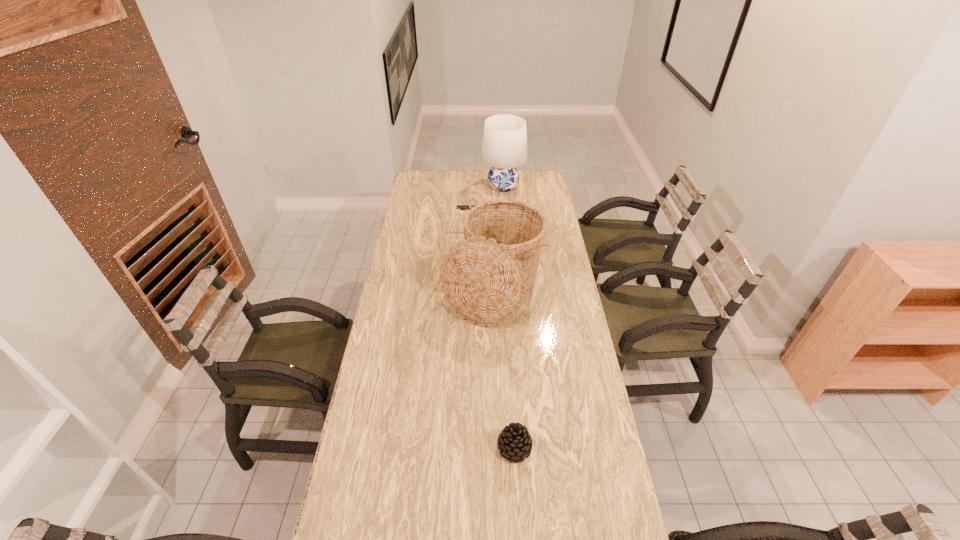
Where is `vacant space located 0.110m along the barrel of the gun`? This screenshot has width=960, height=540. vacant space located 0.110m along the barrel of the gun is located at coordinates (434, 226).

At what (x,y) coordinates should I click in order to perform the action: click on vacant region located 0.150m at the narrow end of the nearest object. Please return your answer as a coordinate pair (x, y). Looking at the image, I should click on (446, 448).

At what (x,y) coordinates should I click in order to perform the action: click on vacant space located at the narrow end of the nearest object. Please return your answer as a coordinate pair (x, y). The width and height of the screenshot is (960, 540). Looking at the image, I should click on (437, 448).

The image size is (960, 540). In order to click on vacant space located at the narrow end of the nearest object in this screenshot , I will do `click(426, 448)`.

Find the location of `object at the far edge`. object at the far edge is located at coordinates (504, 147).

Locate an element on the screen. This screenshot has height=540, width=960. lampshade that is at the right edge is located at coordinates (504, 147).

This screenshot has height=540, width=960. What are the coordinates of `basket present at the right edge` in the screenshot? It's located at (484, 278).

You are a GUI agent. You are given a task and a screenshot of the screen. Output one action in this format:
    pyautogui.click(x=<x>, y=<y>)
    Task: Click on the object that is at the far right corner
    The width and height of the screenshot is (960, 540).
    Given the screenshot: What is the action you would take?
    pyautogui.click(x=504, y=147)

In the image, there is a desktop. Where is `vacant region at the far edge`? vacant region at the far edge is located at coordinates (461, 188).

Locate an element on the screen. The height and width of the screenshot is (540, 960). free space at the left edge of the desktop is located at coordinates (411, 224).